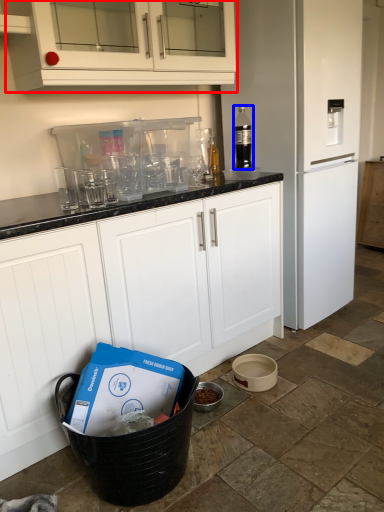
Question: Which point is further to the camera, cabinetry (highlighted by a red box) or bottle (highlighted by a blue box)?

Choices:
 (A) cabinetry
 (B) bottle

Answer: (B)